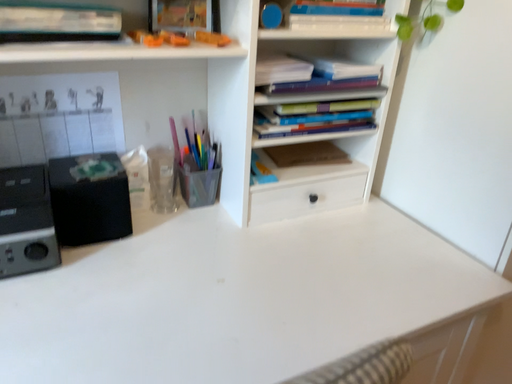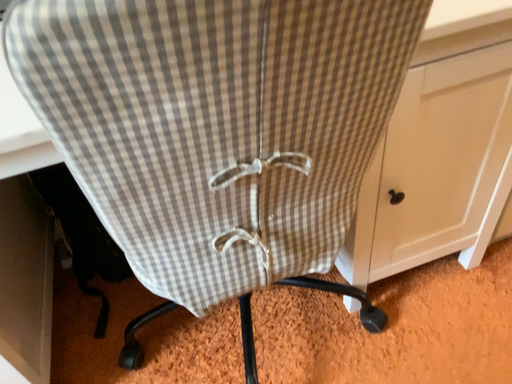
Question: How did the camera likely rotate when shooting the video?

Choices:
 (A) rotated right
 (B) rotated left

Answer: (B)